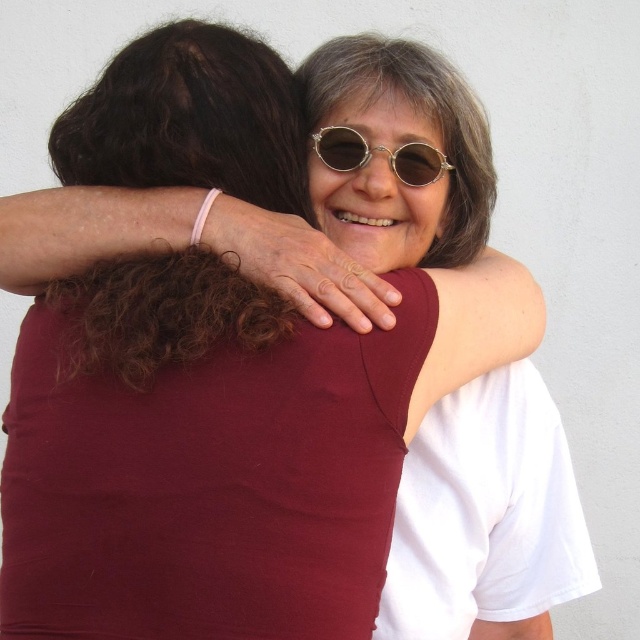
Consider the image. You are organizing a craft workshop and need to place the pink rubber band at upper center and the gold metallic sunglasses at center. According to the image, which object is closer to the viewer?

The pink rubber band at upper center is closer to the viewer because it is in front of the gold metallic sunglasses at center.

In the scene shown: You are organizing a craft workshop and need to place the pink rubber band at upper center and the gold metallic sunglasses at center. According to the image, where should you place the pink rubber band relative to the gold metallic sunglasses?

The pink rubber band at upper center is positioned under the gold metallic sunglasses at center, so you should place the pink rubber band below the gold metallic sunglasses at center.

You are organizing a craft project and need to secure a stack of papers. You have a pink rubber band at upper center and a gold metallic sunglasses at center nearby. Which object can you use to secure the papers effectively?

The pink rubber band at upper center can be used to secure the papers effectively because its width is larger than the gold metallic sunglasses at center, making it more suitable for holding items together.